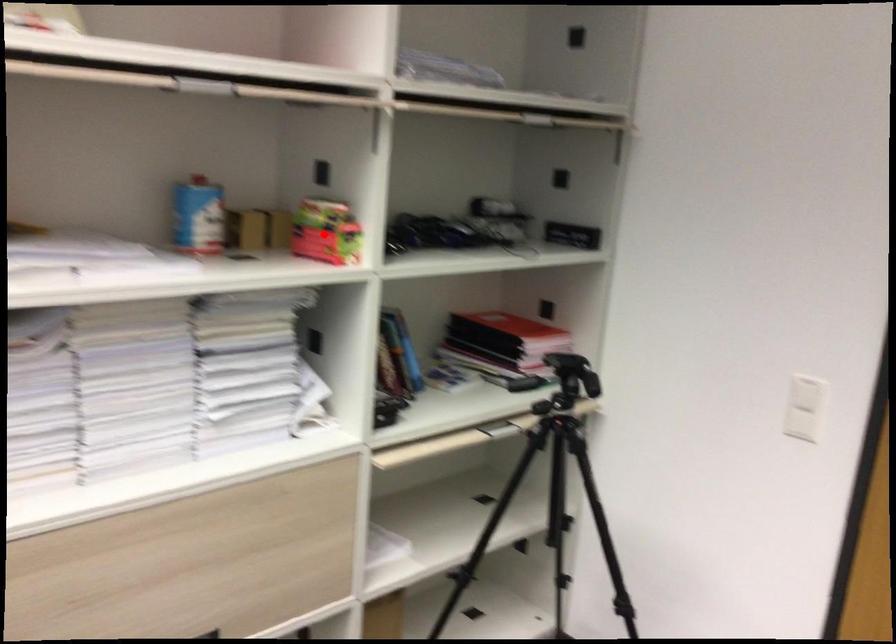
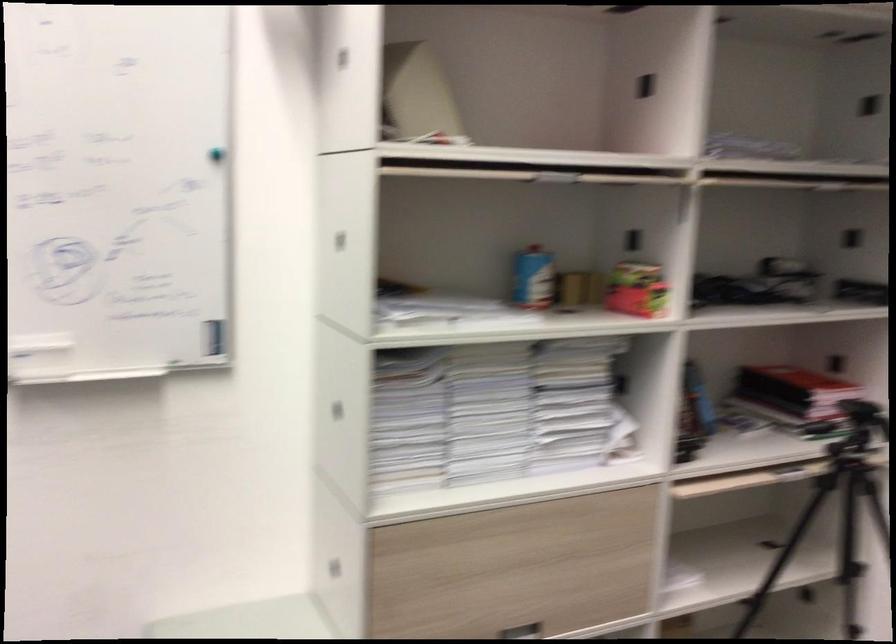
Question: I am providing you with two images of the same scene from different viewpoints. Image1 has a red point marked. In image2, the corresponding 3D location appears at what relative position? Reply with the corresponding letter.

Choices:
 (A) Closer
 (B) Farther

Answer: (B)